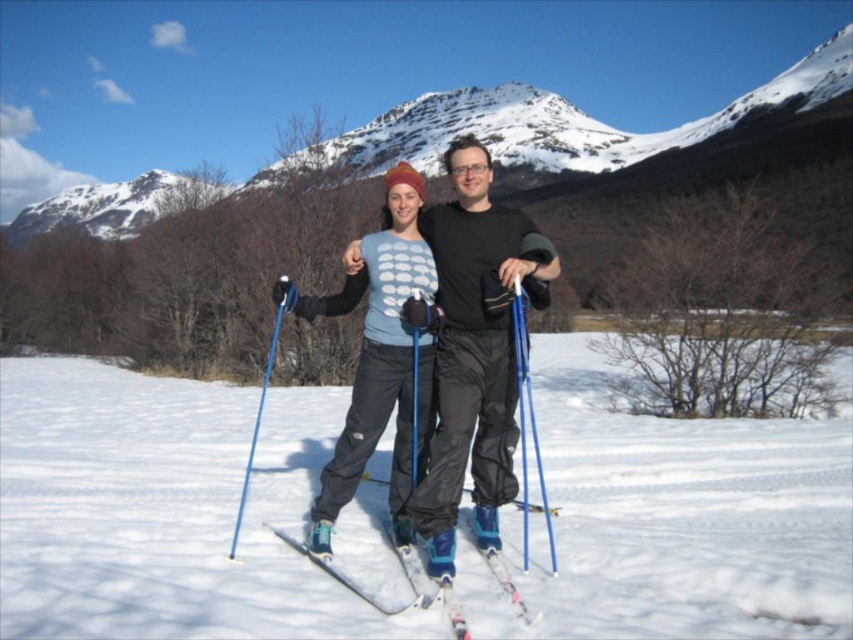
Is point (292, 452) closer to viewer compared to point (286, 536)?

No, it is not.

Is white powder snow at center thinner than white matte ski at center?

No, white powder snow at center is not thinner than white matte ski at center.

Is point (477, 630) less distant than point (312, 554)?

Yes, point (477, 630) is in front of point (312, 554).

The height and width of the screenshot is (640, 853). In order to click on white powder snow at center in this screenshot , I will do `click(161, 509)`.

Who is shorter, matte blue ski pole at center or blue plastic ski pole at center?

With less height is blue plastic ski pole at center.

Is matte blue ski pole at center in front of blue plastic ski pole at center?

No.

Does point (502, 280) lie in front of point (521, 369)?

That is False.

Find the location of a particular element. The width and height of the screenshot is (853, 640). matte blue ski pole at center is located at coordinates (474, 346).

Does white powder snow at center appear under blue metallic ski pole at left?

Yes.

Is point (776, 636) in front of point (265, 372)?

That is True.

Does point (572, 481) come behind point (231, 552)?

That is True.

I want to click on white powder snow at center, so click(x=161, y=509).